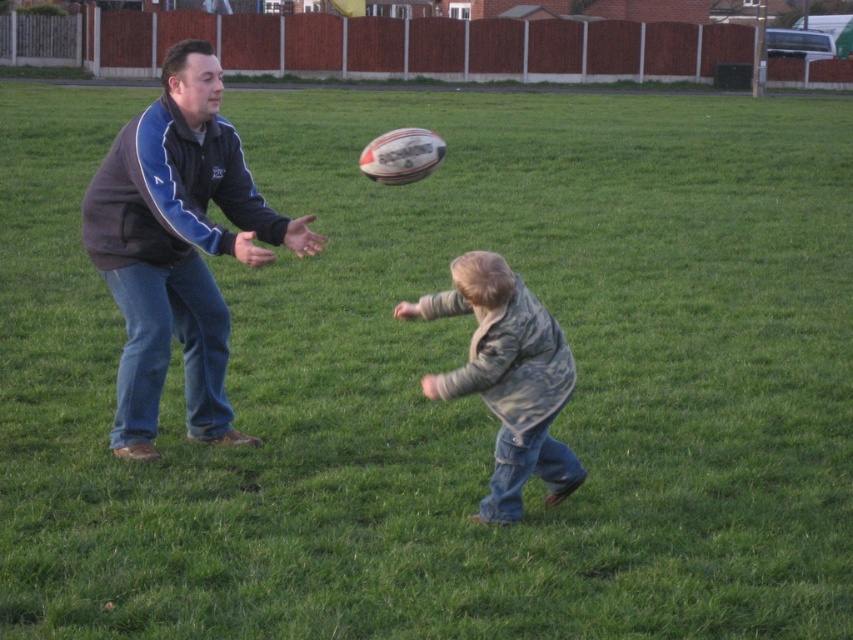
Does point (180, 195) lie behind point (515, 336)?

That is True.

This screenshot has width=853, height=640. Describe the element at coordinates (177, 248) in the screenshot. I see `dark blue fleece jacket at left` at that location.

Measure the distance between dark blue fleece jacket at left and camera.

They are 7.54 meters apart.

Find the location of a particular element. dark blue fleece jacket at left is located at coordinates (177, 248).